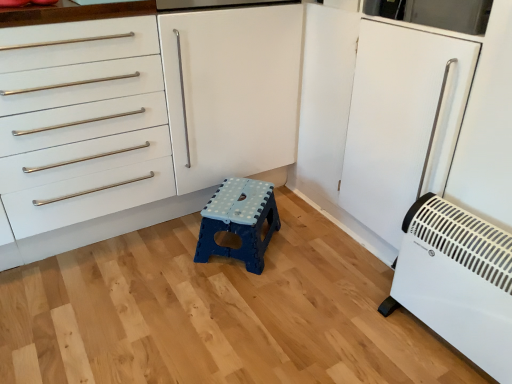
Question: Is blue plastic stool at center positioned in front of white matte cabinet at center?

Choices:
 (A) yes
 (B) no

Answer: (B)

Question: Can you confirm if blue plastic stool at center is smaller than white matte cabinet at center?

Choices:
 (A) yes
 (B) no

Answer: (A)

Question: From the image's perspective, is blue plastic stool at center under white matte cabinet at center?

Choices:
 (A) no
 (B) yes

Answer: (B)

Question: Does blue plastic stool at center turn towards white matte cabinet at center?

Choices:
 (A) no
 (B) yes

Answer: (A)

Question: Are blue plastic stool at center and white matte cabinet at center making contact?

Choices:
 (A) yes
 (B) no

Answer: (B)

Question: Do you think blue plastic stool at center is within white matte cabinet at center, or outside of it?

Choices:
 (A) outside
 (B) inside

Answer: (A)

Question: Is point pos(266,216) closer or farther from the camera than point pos(181,66)?

Choices:
 (A) farther
 (B) closer

Answer: (A)

Question: In the image, is blue plastic stool at center positioned in front of or behind white matte cabinet at center?

Choices:
 (A) behind
 (B) front

Answer: (A)

Question: In terms of size, does blue plastic stool at center appear bigger or smaller than white matte cabinet at center?

Choices:
 (A) small
 (B) big

Answer: (A)

Question: From the image's perspective, relative to white plastic heater at lower right, is white matte cabinet at center above or below?

Choices:
 (A) above
 (B) below

Answer: (A)

Question: From a real-world perspective, relative to white plastic heater at lower right, is white matte cabinet at center vertically above or below?

Choices:
 (A) above
 (B) below

Answer: (A)

Question: Do you think white matte cabinet at center is within white plastic heater at lower right, or outside of it?

Choices:
 (A) inside
 (B) outside

Answer: (B)

Question: Looking at the image, does white matte cabinet at center seem bigger or smaller compared to white plastic heater at lower right?

Choices:
 (A) small
 (B) big

Answer: (B)

Question: Looking at their shapes, would you say white matte cabinet at center is wider or thinner than blue plastic stool at center?

Choices:
 (A) wide
 (B) thin

Answer: (A)

Question: Is point (236, 11) closer or farther from the camera than point (259, 215)?

Choices:
 (A) farther
 (B) closer

Answer: (B)